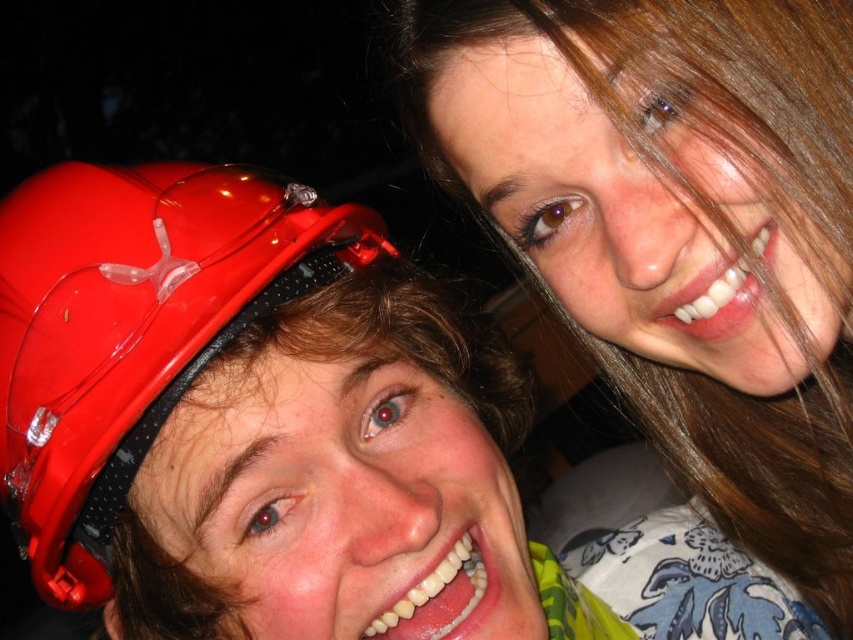
Question: Is shiny brown hair at upper right to the right of matte plastic helmet at left from the viewer's perspective?

Choices:
 (A) yes
 (B) no

Answer: (A)

Question: Among these objects, which one is farthest from the camera?

Choices:
 (A) shiny brown hair at upper right
 (B) matte plastic helmet at left

Answer: (A)

Question: Is shiny brown hair at upper right positioned at the back of matte plastic helmet at left?

Choices:
 (A) yes
 (B) no

Answer: (A)

Question: Where is shiny brown hair at upper right located in relation to matte plastic helmet at left in the image?

Choices:
 (A) above
 (B) below

Answer: (A)